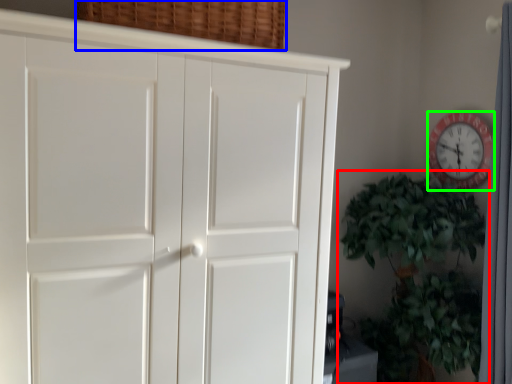
Question: Which object is positioned farthest from houseplant (highlighted by a red box)? Select from basket (highlighted by a blue box) and wall clock (highlighted by a green box).

Choices:
 (A) basket
 (B) wall clock

Answer: (A)